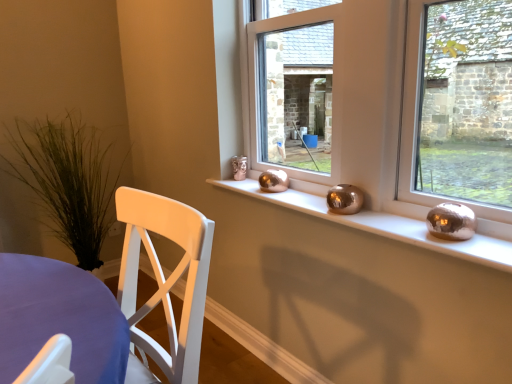
Question: Is metallic spheres at center at the right side of green grass at left?

Choices:
 (A) no
 (B) yes

Answer: (B)

Question: Considering the relative sizes of metallic spheres at center and green grass at left in the image provided, is metallic spheres at center smaller than green grass at left?

Choices:
 (A) yes
 (B) no

Answer: (A)

Question: Is there a large distance between metallic spheres at center and green grass at left?

Choices:
 (A) no
 (B) yes

Answer: (B)

Question: Would you say metallic spheres at center is outside green grass at left?

Choices:
 (A) yes
 (B) no

Answer: (A)

Question: Does metallic spheres at center lie behind green grass at left?

Choices:
 (A) yes
 (B) no

Answer: (B)

Question: Is metallic spheres at center thinner than green grass at left?

Choices:
 (A) no
 (B) yes

Answer: (B)

Question: Could you tell me if metallic gold vase at center is turned towards green grass at left?

Choices:
 (A) yes
 (B) no

Answer: (B)

Question: Is metallic gold vase at center outside green grass at left?

Choices:
 (A) yes
 (B) no

Answer: (A)

Question: Does metallic gold vase at center have a smaller size compared to green grass at left?

Choices:
 (A) yes
 (B) no

Answer: (A)

Question: Considering the relative sizes of metallic gold vase at center and green grass at left in the image provided, is metallic gold vase at center wider than green grass at left?

Choices:
 (A) yes
 (B) no

Answer: (B)

Question: Is metallic gold vase at center at the left side of green grass at left?

Choices:
 (A) no
 (B) yes

Answer: (A)

Question: Is metallic gold vase at center with green grass at left?

Choices:
 (A) yes
 (B) no

Answer: (B)

Question: Could you tell me if metallic gold vase at center is turned towards metallic spheres at center?

Choices:
 (A) yes
 (B) no

Answer: (A)